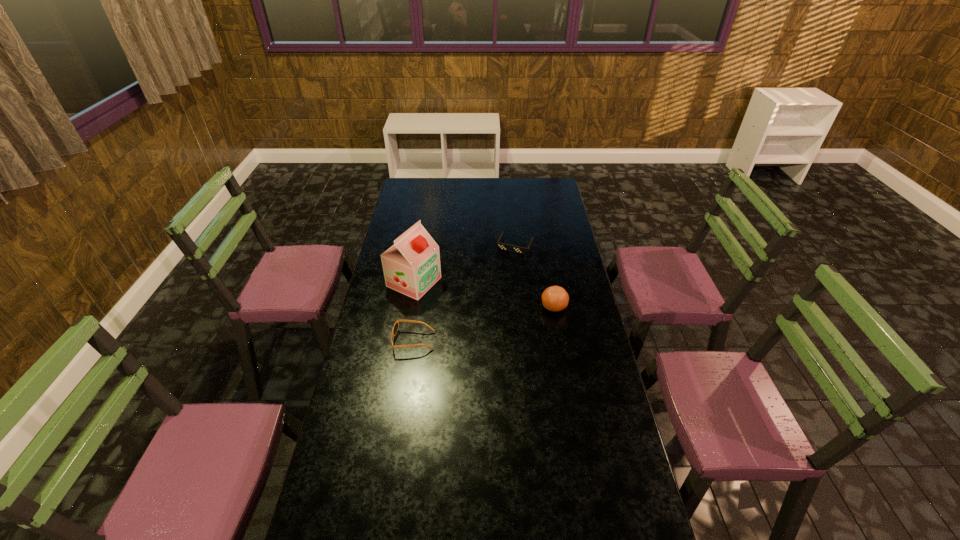
You are a GUI agent. You are given a task and a screenshot of the screen. Output one action in this format:
    pyautogui.click(x=<x>, y=<y>)
    Task: Click on the vacant point located between the clementine and the farthest object
    
    Given the screenshot: What is the action you would take?
    pyautogui.click(x=535, y=276)

Where is `vacant point located between the third tallest object and the third shortest object`? Image resolution: width=960 pixels, height=540 pixels. vacant point located between the third tallest object and the third shortest object is located at coordinates (484, 323).

You are a GUI agent. You are given a task and a screenshot of the screen. Output one action in this format:
    pyautogui.click(x=<x>, y=<y>)
    Task: Click on the free space that is in between the shortest object and the second tallest object
    
    Given the screenshot: What is the action you would take?
    pyautogui.click(x=535, y=276)

This screenshot has width=960, height=540. What are the coordinates of `vacant area between the second tallest object and the tallest object` in the screenshot? It's located at (484, 294).

Find the location of `the third closest object to the clementine`. the third closest object to the clementine is located at coordinates (395, 328).

Choose which object is the nearest neighbor to the taller sunglasses. Please provide its 2D coordinates. Your answer should be formatted as a tuple, i.e. [(x, y)], where the tuple contains the x and y coordinates of a point satisfying the conditions above.

[(411, 266)]

Where is `free spot that satisfies the following two spatial constraints: 1. on the front side of the tallest object; 2. on the front-facing side of the taller sunglasses`? This screenshot has height=540, width=960. free spot that satisfies the following two spatial constraints: 1. on the front side of the tallest object; 2. on the front-facing side of the taller sunglasses is located at coordinates (404, 341).